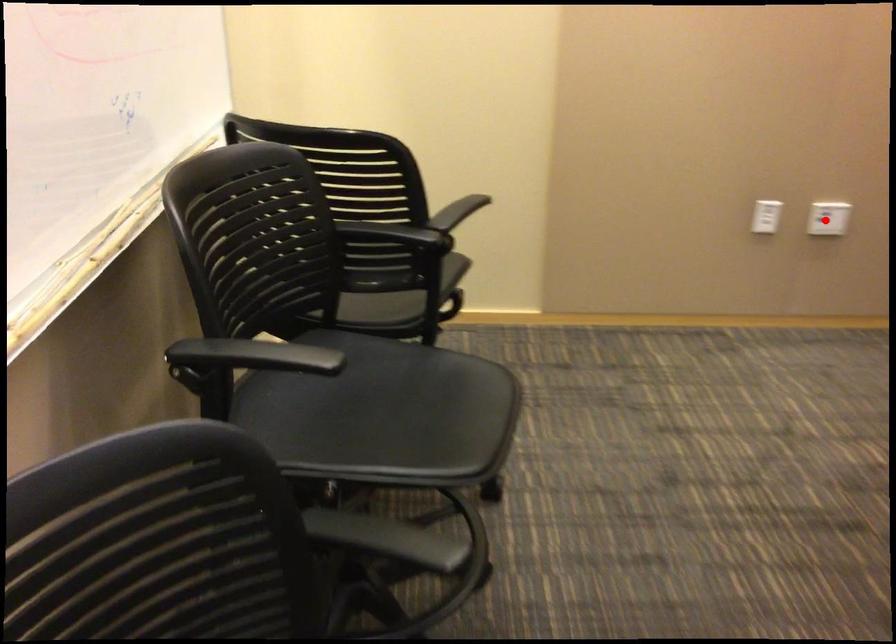
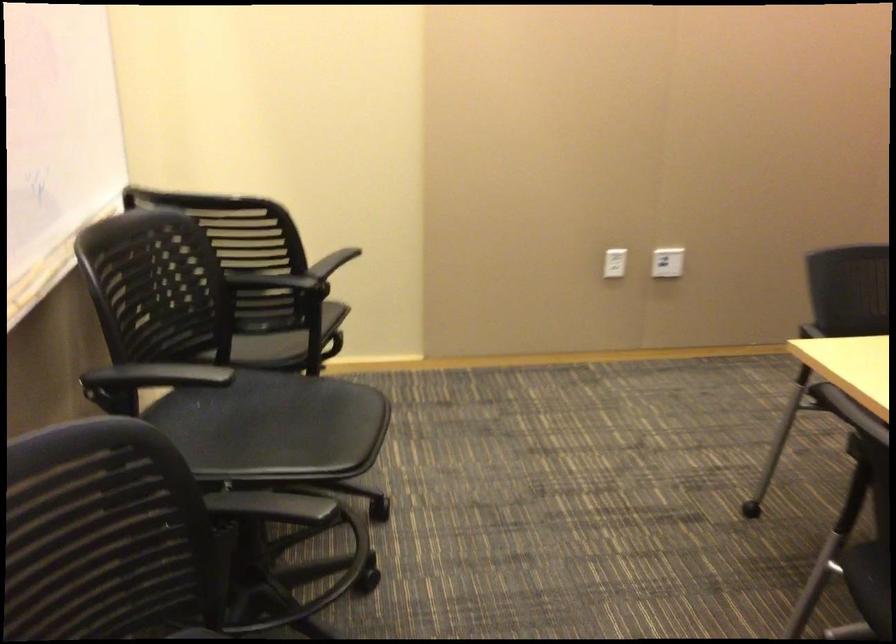
Question: I am providing you with two images of the same scene from different viewpoints. Given a red point in image1, look at the same physical point in image2. Is it:

Choices:
 (A) Closer to the viewpoint
 (B) Farther from the viewpoint

Answer: (B)